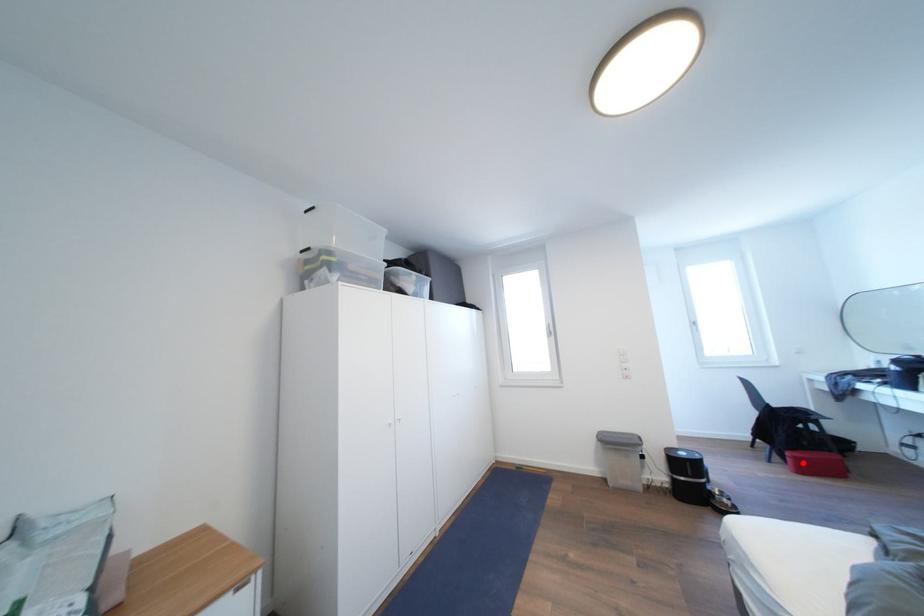
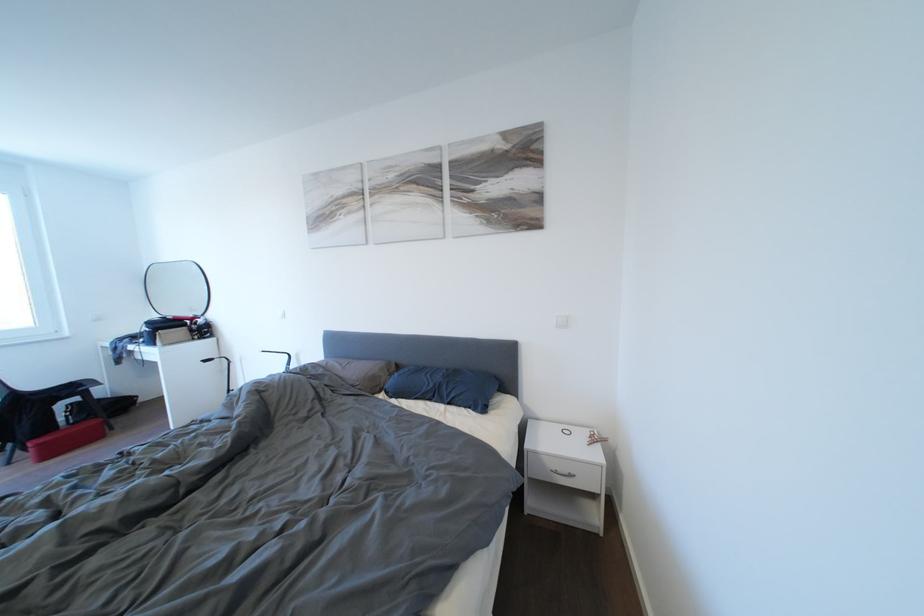
The point at the highlighted location is marked in the first image. Where is the corresponding point in the second image?

(46, 450)